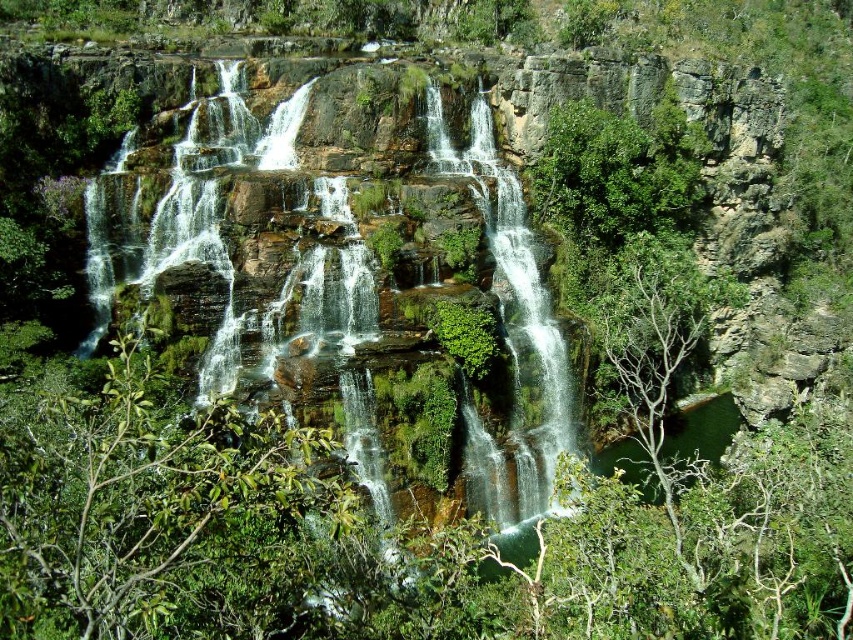
Question: Estimate the real-world distances between objects in this image. Which object is farther from the green mossy rock at center?

Choices:
 (A) white frothy water at center
 (B) green leafy tree at center

Answer: (B)

Question: Among these points, which one is nearest to the camera?

Choices:
 (A) (138, 493)
 (B) (364, 310)

Answer: (A)

Question: Among these objects, which one is nearest to the camera?

Choices:
 (A) green leafy tree at center
 (B) white frothy water at center
 (C) green mossy rock at center

Answer: (A)

Question: Can you confirm if green leafy tree at center is positioned above green mossy rock at center?

Choices:
 (A) yes
 (B) no

Answer: (B)

Question: Does white frothy water at center have a lesser width compared to green mossy rock at center?

Choices:
 (A) yes
 (B) no

Answer: (B)

Question: Is white frothy water at center to the left of green mossy rock at center from the viewer's perspective?

Choices:
 (A) no
 (B) yes

Answer: (B)